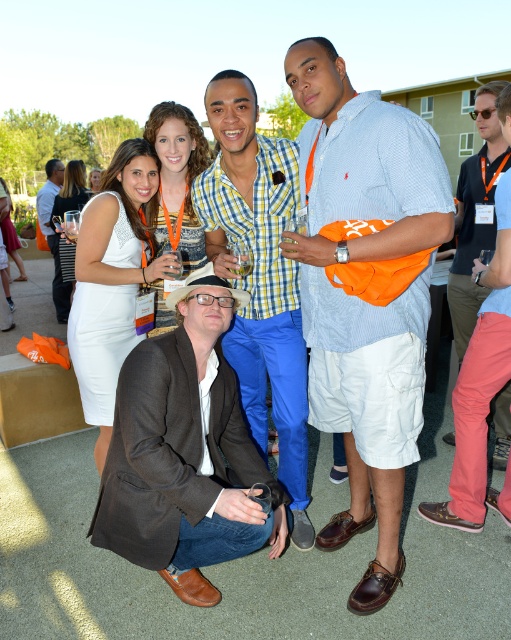
Is light blue woven shirt at center wider than white fabric dress at lower left?

No, light blue woven shirt at center is not wider than white fabric dress at lower left.

Does light blue woven shirt at center have a lesser height compared to white fabric dress at lower left?

In fact, light blue woven shirt at center may be taller than white fabric dress at lower left.

Is point (332, 534) more distant than point (78, 180)?

No, (332, 534) is in front of (78, 180).

The width and height of the screenshot is (511, 640). In order to click on light blue woven shirt at center in this screenshot , I will do `click(365, 291)`.

Who is more forward, (x=273, y=163) or (x=56, y=262)?

Positioned in front is point (x=273, y=163).

Looking at this image, can you confirm if checkered shirt at center is smaller than matte black suit at lower left?

Yes, checkered shirt at center is smaller than matte black suit at lower left.

Find the location of a particular element. The height and width of the screenshot is (640, 511). checkered shirt at center is located at coordinates (259, 276).

Where is `checkered shirt at center`? This screenshot has width=511, height=640. checkered shirt at center is located at coordinates (259, 276).

Does brown leather jacket at lower center have a lesser height compared to white textured dress at center?

Correct, brown leather jacket at lower center is not as tall as white textured dress at center.

Between brown leather jacket at lower center and white textured dress at center, which one has more height?

Standing taller between the two is white textured dress at center.

Find the location of `brown leather jacket at lower center`. brown leather jacket at lower center is located at coordinates (183, 454).

This screenshot has height=640, width=511. Identify the location of brown leather jacket at lower center. (183, 454).